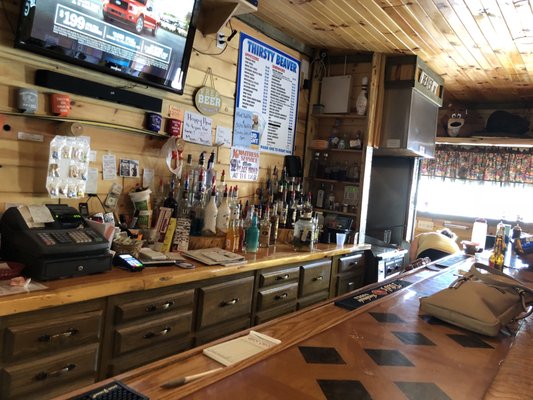
Locate an element on the screen. The image size is (533, 400). window is located at coordinates (479, 206).